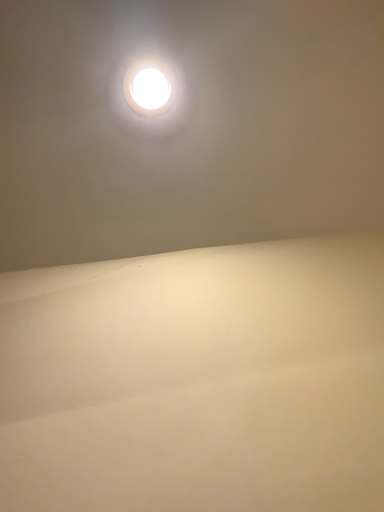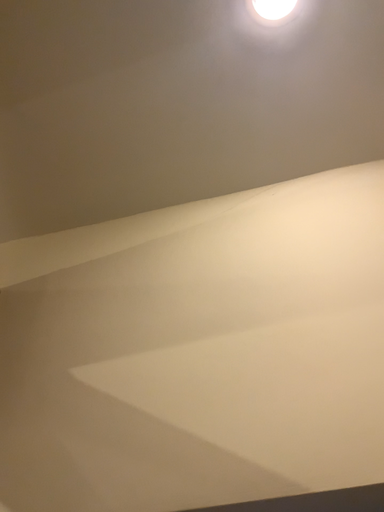
Question: How did the camera likely rotate when shooting the video?

Choices:
 (A) rotated upward
 (B) rotated downward

Answer: (B)